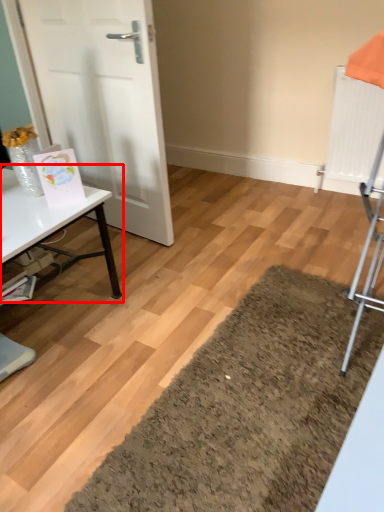
Question: Observing the image, what is the correct spatial positioning of table (annotated by the red box) in reference to door?

Choices:
 (A) left
 (B) right

Answer: (A)